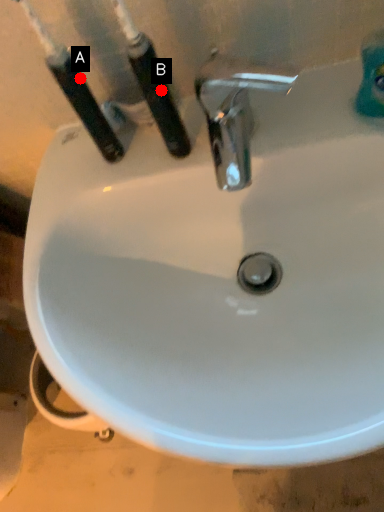
Question: Two points are circled on the image, labeled by A and B beside each circle. Which of the following is the closest to the observer?

Choices:
 (A) A is closer
 (B) B is closer

Answer: (B)